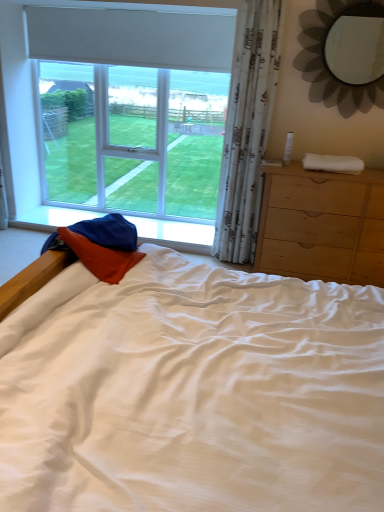
What do you see at coordinates (247, 128) in the screenshot?
I see `white sheer curtain at right` at bounding box center [247, 128].

Describe the element at coordinates (325, 64) in the screenshot. I see `metallic flower-shaped mirror at upper right` at that location.

Image resolution: width=384 pixels, height=512 pixels. I want to click on white soft towel at right, so click(x=333, y=163).

Is metallic flower-shaped mirror at upper right oriented away from light brown wooden chest of drawers at right?

metallic flower-shaped mirror at upper right is not turned away from light brown wooden chest of drawers at right.

Is metallic flower-shaped mirror at upper right positioned far away from light brown wooden chest of drawers at right?

Result: Actually, metallic flower-shaped mirror at upper right and light brown wooden chest of drawers at right are a little close together.

Does metallic flower-shaped mirror at upper right appear on the left side of light brown wooden chest of drawers at right?

No.

Is white matte window at upper left facing towards light brown wooden chest of drawers at right?

No, white matte window at upper left is not facing towards light brown wooden chest of drawers at right.

How different are the orientations of white matte window at upper left and light brown wooden chest of drawers at right in degrees?

white matte window at upper left and light brown wooden chest of drawers at right are facing 1.26 degrees away from each other.

Considering the relative positions of white matte window at upper left and light brown wooden chest of drawers at right in the image provided, is white matte window at upper left behind light brown wooden chest of drawers at right?

Yes, white matte window at upper left is behind light brown wooden chest of drawers at right.

Is white matte window at upper left taller or shorter than light brown wooden chest of drawers at right?

Clearly, white matte window at upper left is taller compared to light brown wooden chest of drawers at right.

Between white sheer curtain at right and white soft towel at right, which one is positioned in front?

Positioned in front is white sheer curtain at right.

Between white sheer curtain at right and white soft towel at right, which one has larger width?

With larger width is white soft towel at right.

In terms of height, does white sheer curtain at right look taller or shorter compared to white soft towel at right?

Considering their sizes, white sheer curtain at right has more height than white soft towel at right.

Does point (260, 144) appear closer or farther from the camera than point (324, 157)?

Point (260, 144) is farther from the camera than point (324, 157).

Is metallic flower-shaped mirror at upper right inside white soft towel at right?

No, white soft towel at right does not contain metallic flower-shaped mirror at upper right.

From the picture: Are white soft towel at right and metallic flower-shaped mirror at upper right making contact?

white soft towel at right and metallic flower-shaped mirror at upper right are not in contact.

Between point (354, 166) and point (308, 50), which one is positioned behind?

The point (308, 50) is farther from the camera.

From the image's perspective, between light brown wooden chest of drawers at right and white soft towel at right, who is located below?

light brown wooden chest of drawers at right is shown below in the image.

Is light brown wooden chest of drawers at right with white soft towel at right?

No, light brown wooden chest of drawers at right is not beside white soft towel at right.

Which object is wider, light brown wooden chest of drawers at right or white soft towel at right?

light brown wooden chest of drawers at right.

In terms of size, does light brown wooden chest of drawers at right appear bigger or smaller than white soft towel at right?

Considering their sizes, light brown wooden chest of drawers at right takes up more space than white soft towel at right.

Is point (345, 231) positioned before point (199, 26)?

Yes, it is in front of point (199, 26).

Can you confirm if light brown wooden chest of drawers at right is positioned to the left of white matte window at upper left?

Incorrect, light brown wooden chest of drawers at right is not on the left side of white matte window at upper left.

Which of these two, light brown wooden chest of drawers at right or white matte window at upper left, stands taller?

With more height is white matte window at upper left.

Is white matte window at upper left surrounded by light brown wooden chest of drawers at right?

Actually, white matte window at upper left is outside light brown wooden chest of drawers at right.

Is white soft towel at right turned away from light brown wooden chest of drawers at right?

No, light brown wooden chest of drawers at right is not at the back of white soft towel at right.

Considering the sizes of white soft towel at right and light brown wooden chest of drawers at right in the image, is white soft towel at right bigger or smaller than light brown wooden chest of drawers at right?

In the image, white soft towel at right appears to be smaller than light brown wooden chest of drawers at right.

Is white soft towel at right to the left or to the right of light brown wooden chest of drawers at right in the image?

In the image, white soft towel at right appears on the left side of light brown wooden chest of drawers at right.

From a real-world perspective, which is physically below, white soft towel at right or light brown wooden chest of drawers at right?

light brown wooden chest of drawers at right is physically lower.

In the image, there is a metallic flower-shaped mirror at upper right. At what (x,y) coordinates should I click in order to perform the action: click on the chest of drawers below it (from the image's perspective). Please return your answer as a coordinate pair (x, y). This screenshot has width=384, height=512. Looking at the image, I should click on (322, 225).

Image resolution: width=384 pixels, height=512 pixels. I want to click on window lying behind the light brown wooden chest of drawers at right, so click(139, 64).

Based on their spatial positions, is metallic flower-shaped mirror at upper right or white matte window at upper left closer to white soft towel at right?

Among the two, metallic flower-shaped mirror at upper right is located nearer to white soft towel at right.

Looking at this image, from the image, which object appears to be farther from metallic flower-shaped mirror at upper right, white matte window at upper left or white sheer curtain at right?

white matte window at upper left is positioned further to the anchor metallic flower-shaped mirror at upper right.

Estimate the real-world distances between objects in this image. Which object is further from light brown wooden chest of drawers at right, white soft towel at right or white sheer curtain at right?

white sheer curtain at right is positioned further to the anchor light brown wooden chest of drawers at right.

Which object lies further to the anchor point white matte window at upper left, white soft towel at right or light brown wooden chest of drawers at right?

Among the two, white soft towel at right is located further to white matte window at upper left.

Considering their positions, is light brown wooden chest of drawers at right positioned closer to white sheer curtain at right than white matte window at upper left?

light brown wooden chest of drawers at right lies closer to white sheer curtain at right than the other object.

Consider the image. Estimate the real-world distances between objects in this image. Which object is closer to metallic flower-shaped mirror at upper right, white matte window at upper left or white soft towel at right?

white soft towel at right.

Which object lies nearer to the anchor point metallic flower-shaped mirror at upper right, light brown wooden chest of drawers at right or white sheer curtain at right?

Among the two, white sheer curtain at right is located nearer to metallic flower-shaped mirror at upper right.

When comparing their distances from white sheer curtain at right, does white soft towel at right or metallic flower-shaped mirror at upper right seem closer?

metallic flower-shaped mirror at upper right is positioned closer to the anchor white sheer curtain at right.

Find the location of `cloth situated between white matte window at upper left and metallic flower-shaped mirror at upper right from left to right`. cloth situated between white matte window at upper left and metallic flower-shaped mirror at upper right from left to right is located at coordinates (333, 163).

You are a GUI agent. You are given a task and a screenshot of the screen. Output one action in this format:
    pyautogui.click(x=<x>, y=<y>)
    Task: Click on the curtain situated between white matte window at upper left and white soft towel at right from left to right
    The width and height of the screenshot is (384, 512).
    Given the screenshot: What is the action you would take?
    [247, 128]

I want to click on curtain that lies between metallic flower-shaped mirror at upper right and light brown wooden chest of drawers at right from top to bottom, so click(247, 128).

The height and width of the screenshot is (512, 384). Identify the location of curtain between metallic flower-shaped mirror at upper right and white soft towel at right in the vertical direction. (247, 128).